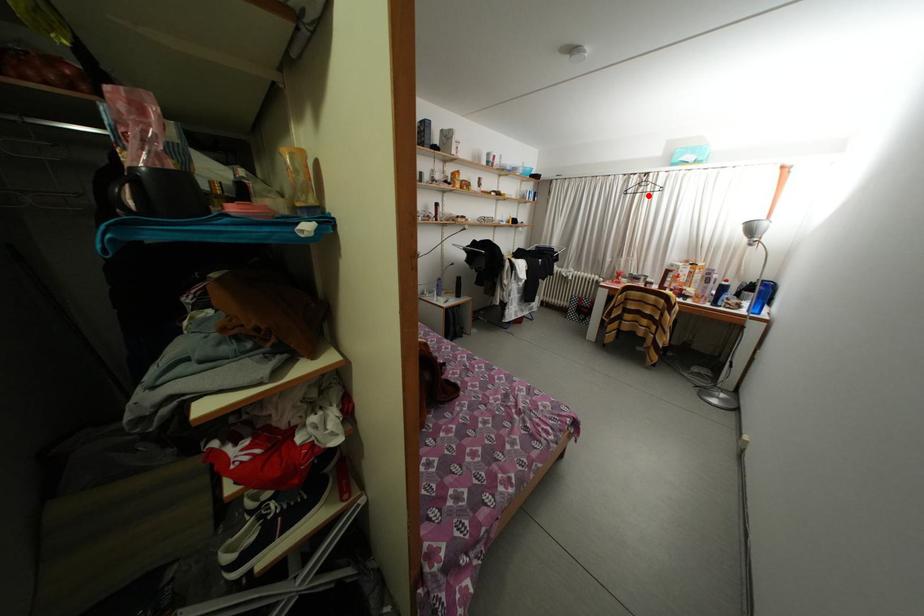
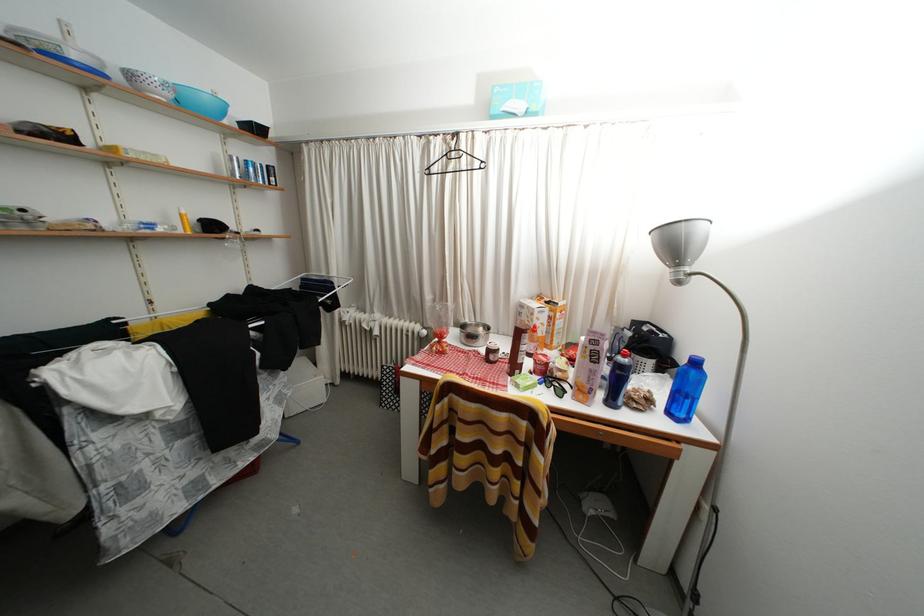
Where in the second image is the point corresponding to the highlighted location from the first image?

(458, 172)